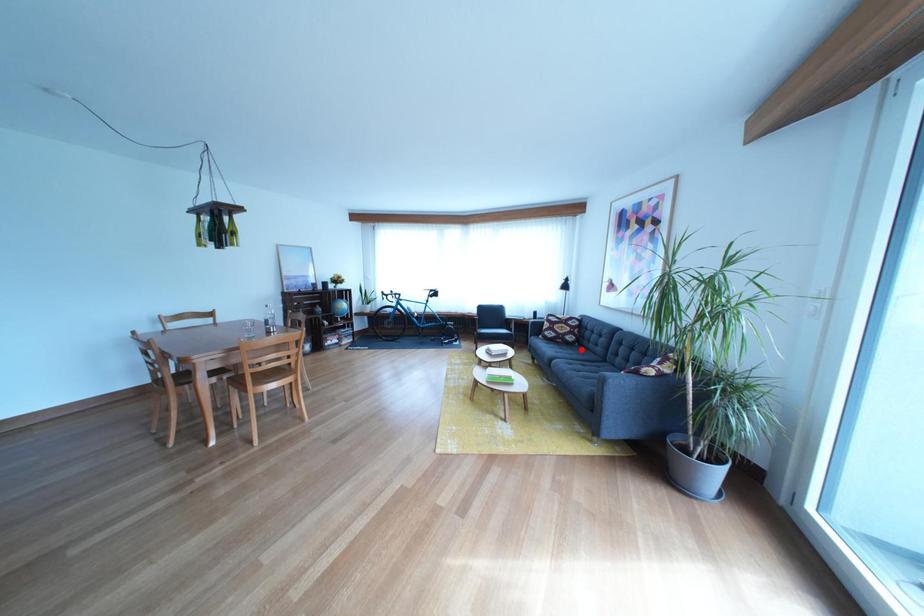
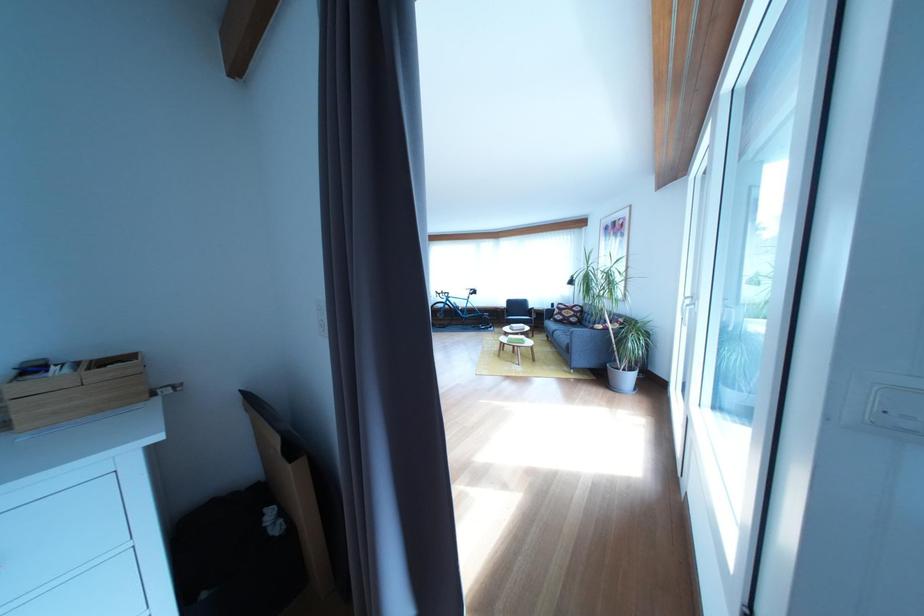
Question: I am providing you with two images of the same scene from different viewpoints. A red point is shown in image1. For the corresponding object point in image2, is it positioned nearer or farther from the camera?

Choices:
 (A) Nearer
 (B) Farther

Answer: (A)